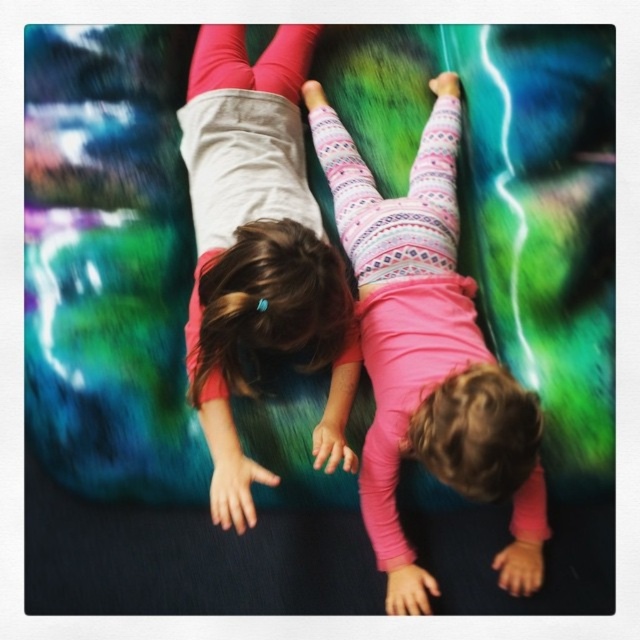
You are a photographer trying to capture the two children on the inflatable surface. You want to ensure that both the pink textured leggings at center and the pink matte leggings at upper center are visible in the frame. Based on their positions, which child is positioned to the right of the other?

The pink textured leggings at center is to the right of the pink matte leggings at upper center, so the child wearing pink textured leggings at center is positioned to the right of the child wearing pink matte leggings at upper center.

You are a parent trying to ensure safety between the two children. The safety guideline states that children must be at least 10 inches apart. Are the pink textured leggings at center and pink matte leggings at upper center meeting the safety requirement?

The distance between the pink textured leggings at center and pink matte leggings at upper center is 8.10 inches, which is less than the required 10 inches. Therefore, they are not meeting the safety requirement.

You are a photographer trying to capture a clear shot of the pink textured leggings at center and the pink matte leggings at upper center. Since the background is blurred, which of the two leggings should you focus on to ensure it appears sharp in the photo?

You should focus on the pink textured leggings at center because it is in front of the pink matte leggings at upper center, making it closer to the camera and thus more likely to be in focus.